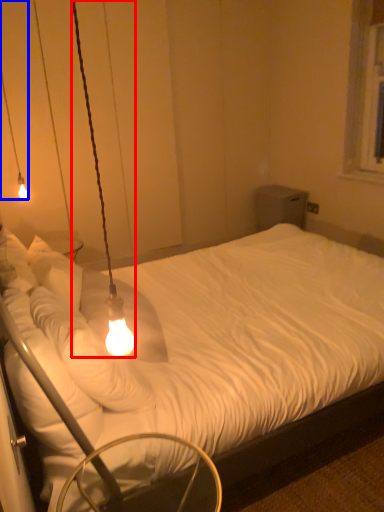
Question: Which point is closer to the camera, lamp (highlighted by a red box) or lamp (highlighted by a blue box)?

Choices:
 (A) lamp
 (B) lamp

Answer: (A)